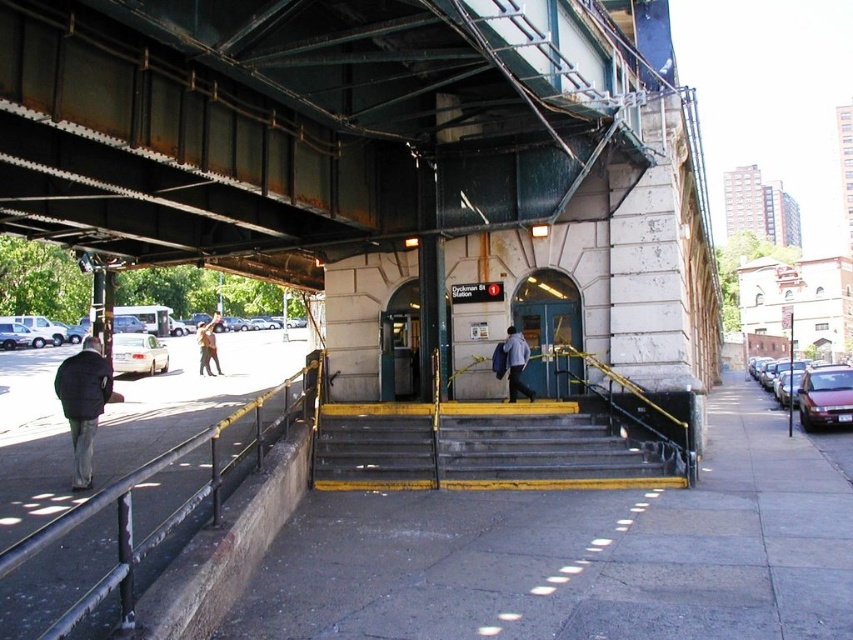
In the scene shown: Is black metal/rail at left to the left of yellow painted metal stairs at center from the viewer's perspective?

Correct, you'll find black metal/rail at left to the left of yellow painted metal stairs at center.

Is point (21, 604) behind point (479, 474)?

No, it is not.

You are a GUI agent. You are given a task and a screenshot of the screen. Output one action in this format:
    pyautogui.click(x=<x>, y=<y>)
    Task: Click on the black metal/rail at left
    
    Given the screenshot: What is the action you would take?
    pyautogui.click(x=138, y=518)

Between gray concrete pavement at center and light blue shirt at center, which one is positioned higher?

light blue shirt at center is above.

Describe the element at coordinates (578, 554) in the screenshot. I see `gray concrete pavement at center` at that location.

Between point (672, 506) and point (511, 376), which one is positioned in front?

Point (672, 506)

This screenshot has height=640, width=853. I want to click on gray concrete pavement at center, so click(x=578, y=554).

This screenshot has height=640, width=853. I want to click on black metal/rail at left, so click(x=138, y=518).

Who is higher up, black metal/rail at left or camouflage jacket at center?

Positioned higher is camouflage jacket at center.

I want to click on black metal/rail at left, so coord(138,518).

Image resolution: width=853 pixels, height=640 pixels. What are the coordinates of `black metal/rail at left` in the screenshot? It's located at (138, 518).